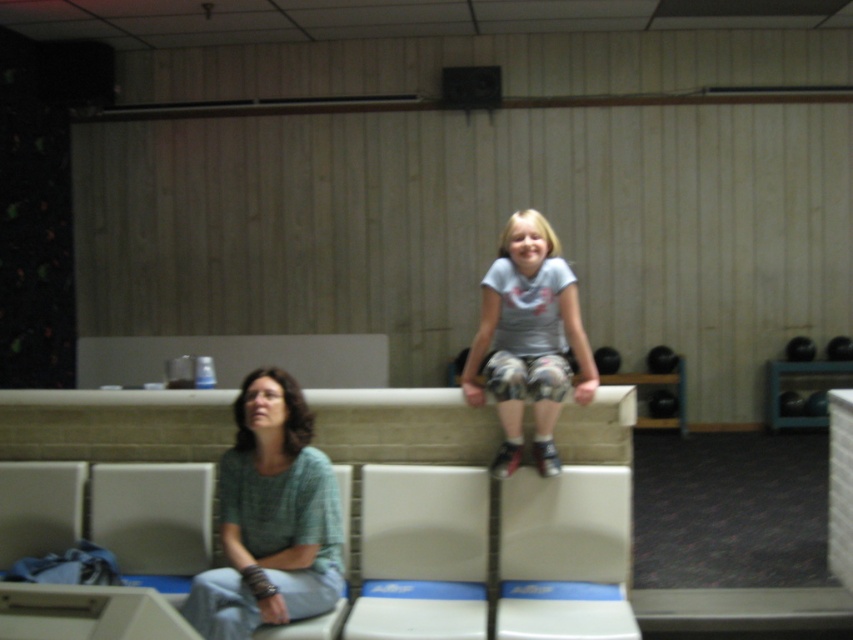
Question: Which point is farther to the camera?

Choices:
 (A) (506, 244)
 (B) (202, 392)

Answer: (B)

Question: Can you confirm if green woven shirt at center is positioned to the left of gray cotton shirt at center?

Choices:
 (A) yes
 (B) no

Answer: (A)

Question: Which object is the closest to the green woven shirt at center?

Choices:
 (A) gray cotton shirt at center
 (B) wooden bench at upper center

Answer: (B)

Question: Considering the real-world distances, which object is closest to the wooden bench at upper center?

Choices:
 (A) green woven shirt at center
 (B) gray cotton shirt at center

Answer: (B)

Question: Is wooden bench at upper center further to camera compared to green woven shirt at center?

Choices:
 (A) yes
 (B) no

Answer: (A)

Question: Is green woven shirt at center positioned at the back of gray cotton shirt at center?

Choices:
 (A) no
 (B) yes

Answer: (A)